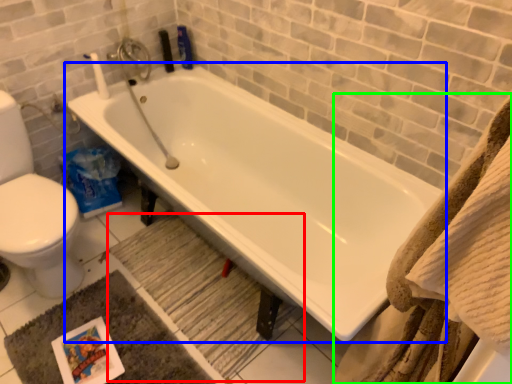
Question: Which is farther away from bath mat (highlighted by a red box)? bathtub (highlighted by a blue box) or bath towel (highlighted by a green box)?

Choices:
 (A) bathtub
 (B) bath towel

Answer: (B)